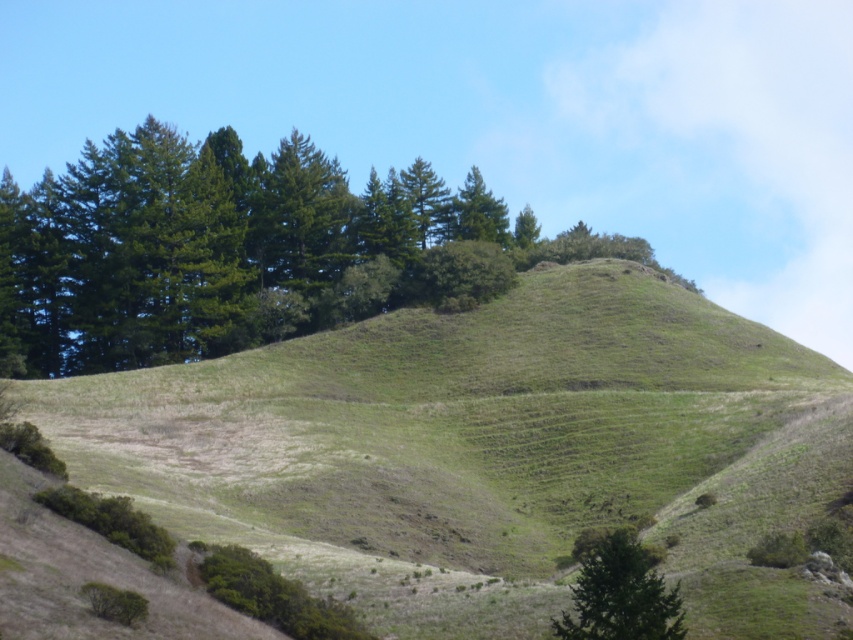
Who is lower down, green leafy trees at upper center or green matte tree at lower right?

green matte tree at lower right is below.

What do you see at coordinates (242, 250) in the screenshot? The image size is (853, 640). I see `green leafy trees at upper center` at bounding box center [242, 250].

Identify the location of green leafy trees at upper center. (242, 250).

Which is behind, point (605, 472) or point (126, 212)?

The point (126, 212) is behind.

Is point (552, 344) more distant than point (132, 179)?

No, (552, 344) is closer to viewer.

Which is in front, point (575, 365) or point (165, 330)?

Point (575, 365) is in front.

Image resolution: width=853 pixels, height=640 pixels. Find the location of `green grassy hillside at center`. green grassy hillside at center is located at coordinates (485, 451).

Can you confirm if green grassy hillside at center is shorter than green matte tree at lower right?

In fact, green grassy hillside at center may be taller than green matte tree at lower right.

Can you confirm if green grassy hillside at center is positioned to the left of green matte tree at lower right?

Indeed, green grassy hillside at center is positioned on the left side of green matte tree at lower right.

Identify the location of green grassy hillside at center. Image resolution: width=853 pixels, height=640 pixels. (485, 451).